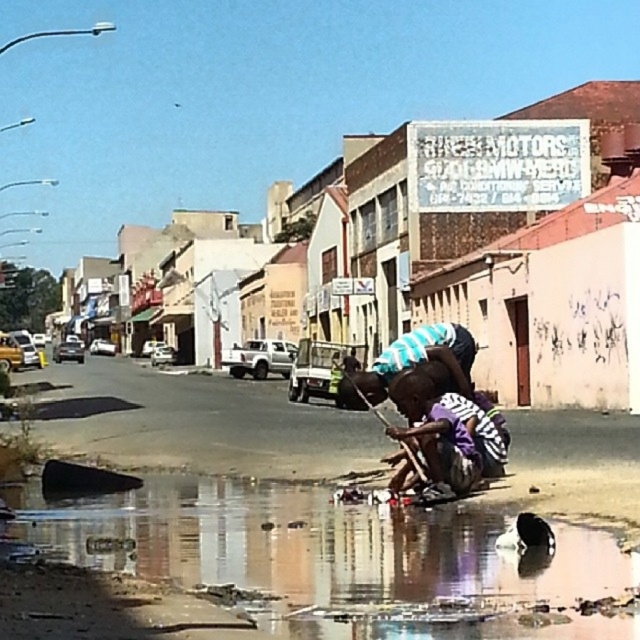
Question: Is reflective wet sand at lower center to the right of purple striped shirt at center from the viewer's perspective?

Choices:
 (A) yes
 (B) no

Answer: (B)

Question: Is reflective wet sand at lower center in front of purple striped shirt at center?

Choices:
 (A) yes
 (B) no

Answer: (A)

Question: Which point is farther to the camera?

Choices:
 (A) purple striped shirt at center
 (B) reflective wet sand at lower center

Answer: (A)

Question: Is reflective wet sand at lower center below purple striped shirt at center?

Choices:
 (A) yes
 (B) no

Answer: (A)

Question: Which point is farther to the camera?

Choices:
 (A) (499, 445)
 (B) (182, 577)

Answer: (A)